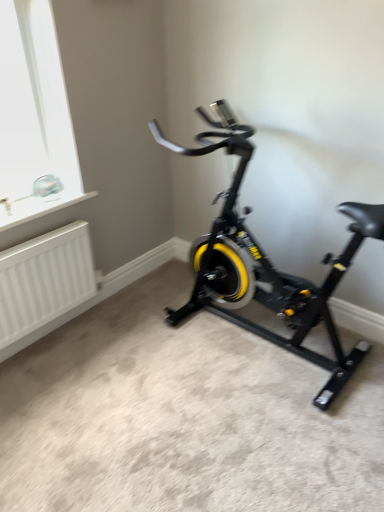
Where is `space that is in front of black matte stationary bicycle at center`? space that is in front of black matte stationary bicycle at center is located at coordinates 252,435.